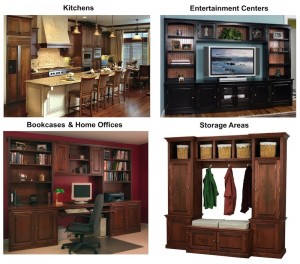
The width and height of the screenshot is (300, 264). Find the location of `office chair`. office chair is located at coordinates (83, 230).